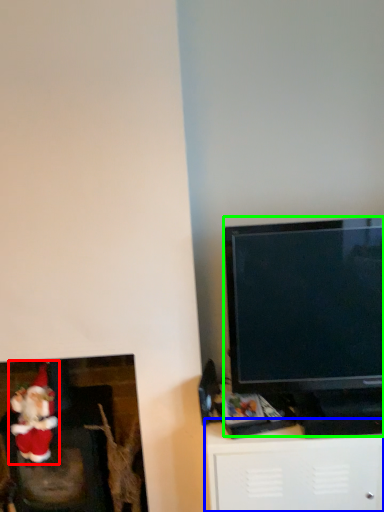
Question: Which object is positioned farthest from santa claus (highlighted by a red box)? Select from furniture (highlighted by a blue box) and television (highlighted by a green box).

Choices:
 (A) furniture
 (B) television

Answer: (B)